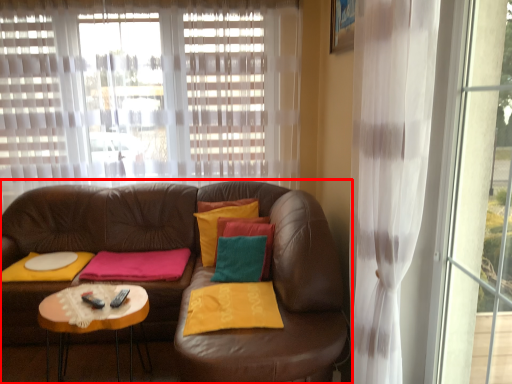
Question: Where is studio couch (annotated by the red box) located in relation to curtain in the image?

Choices:
 (A) left
 (B) right

Answer: (A)